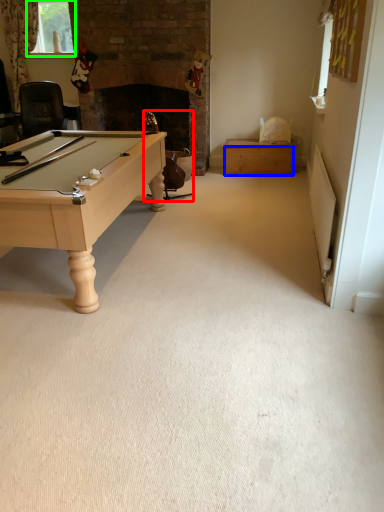
Question: Estimate the real-world distances between objects in this image. Which object is closer to swivel chair (highlighted by a red box), drawer (highlighted by a blue box) or window screen (highlighted by a green box)?

Choices:
 (A) drawer
 (B) window screen

Answer: (A)